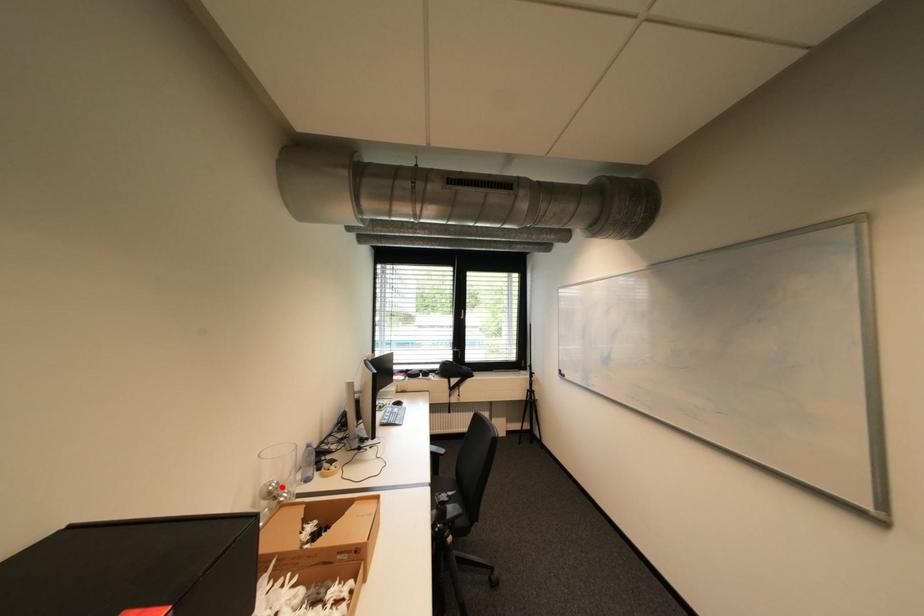
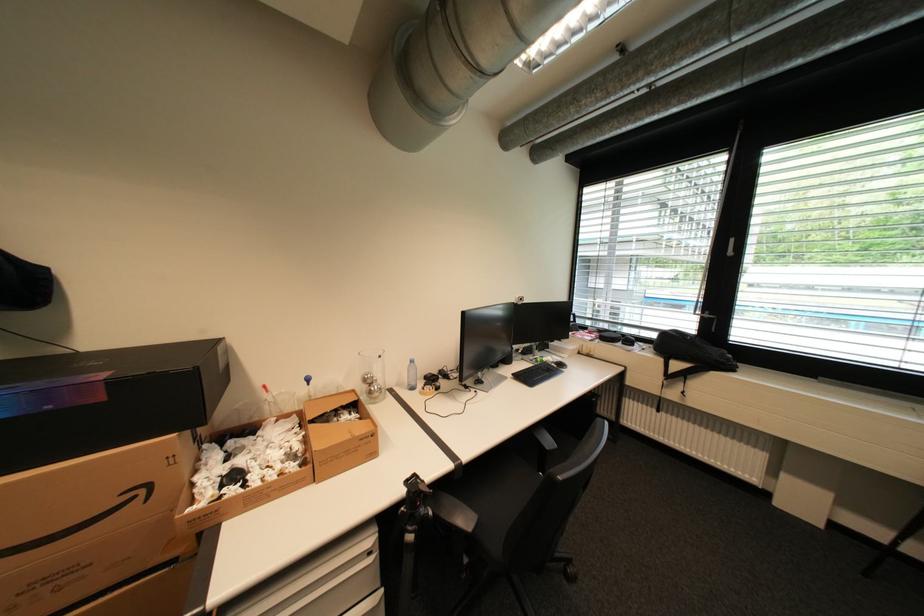
Locate, in the second image, the point that corresponds to the highlighted location in the first image.

(377, 378)